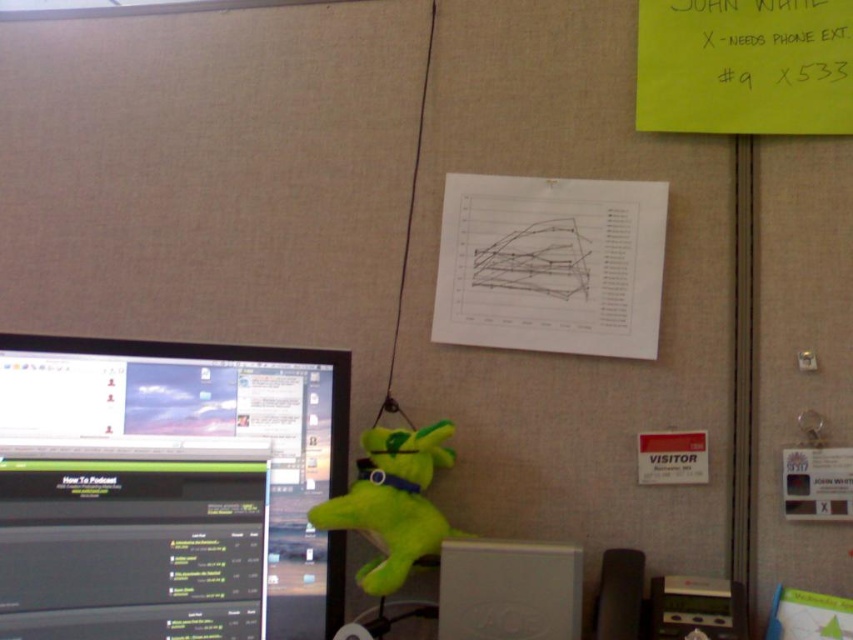
You are an office worker who needs to place a new monitor stand that requires 12 inches of vertical space. You see the white plastic computer at lower center and the green plush toy at center. Which object can fit into the stand without exceeding the height limit?

The white plastic computer at lower center is not as tall as the green plush toy at center, so the white plastic computer at lower center can fit into the stand since it is shorter than 12 inches.

You are an office worker who needs to access the webpage displayed on the white plastic computer at lower center. However, you notice the green plush toy at center is blocking your view. Can you move the toy to see the screen clearly?

The white plastic computer at lower center is in front of the green plush toy at center, so moving the green plush toy at center would allow you to see the screen clearly.